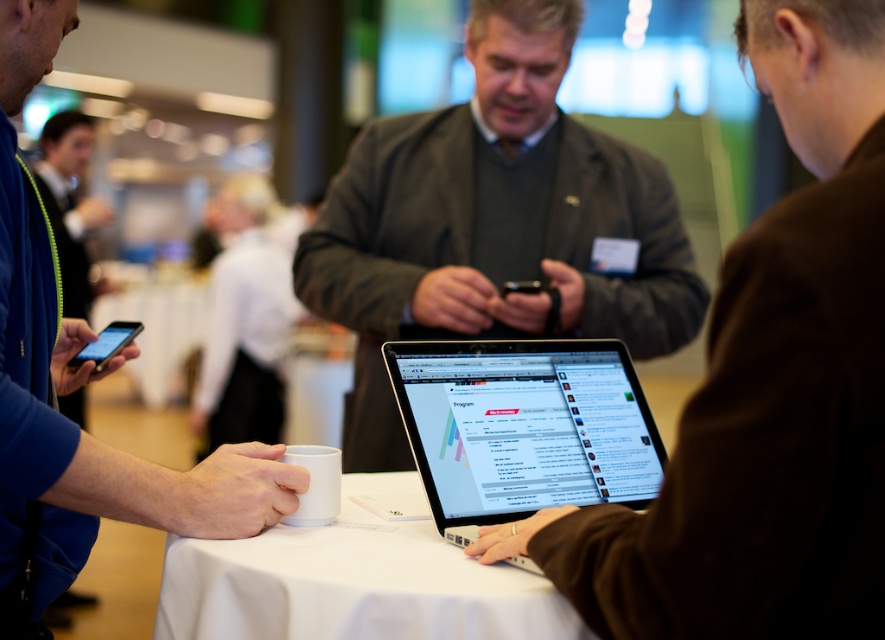
Is blue fabric jacket at upper left further to camera compared to white matte cup at lower center?

No.

This screenshot has height=640, width=885. Find the location of `blue fabric jacket at upper left`. blue fabric jacket at upper left is located at coordinates (78, 387).

Which is above, satin black laptop at center or white matte cup at lower center?

satin black laptop at center is above.

Does satin black laptop at center have a greater height compared to white matte cup at lower center?

Yes.

Find the location of a particular element. satin black laptop at center is located at coordinates (522, 428).

Between point (722, 275) and point (75, 365), which one is positioned behind?

Positioned behind is point (75, 365).

Does matte black laptop at center appear on the right side of matte black smartphone at left?

Correct, you'll find matte black laptop at center to the right of matte black smartphone at left.

Is point (775, 100) closer to viewer compared to point (105, 339)?

Yes, it is.

Identify the location of matte black laptop at center. This screenshot has height=640, width=885. (767, 388).